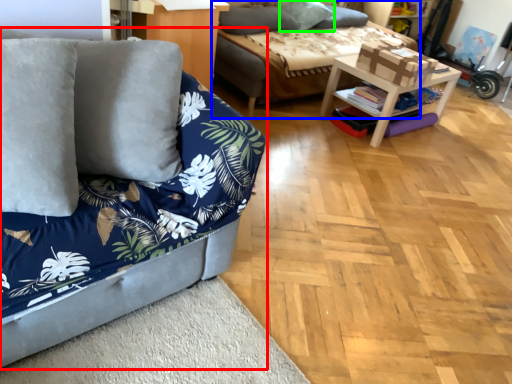
Question: Based on their relative distances, which object is farther from studio couch (highlighted by a red box)? Choose from studio couch (highlighted by a blue box) and pillow (highlighted by a green box).

Choices:
 (A) studio couch
 (B) pillow

Answer: (B)